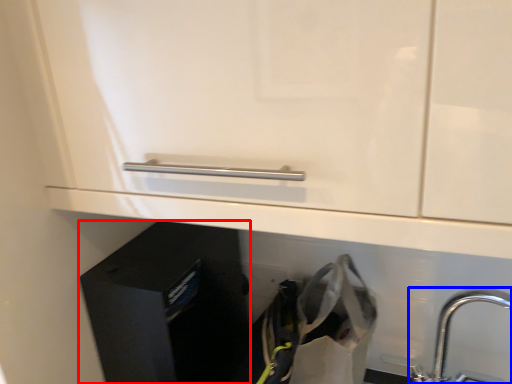
Question: Among these objects, which one is nearest to the camera, file cabinet (highlighted by a red box) or tap (highlighted by a blue box)?

Choices:
 (A) file cabinet
 (B) tap

Answer: (B)